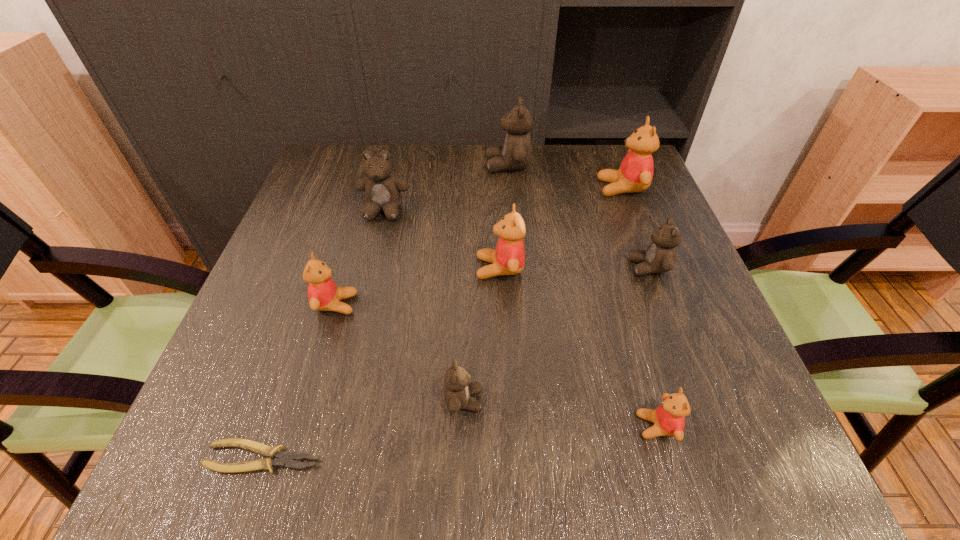
The width and height of the screenshot is (960, 540). In order to click on vacant space located on the front-facing side of the smallest red teddy bear in this screenshot , I will do `click(424, 426)`.

Find the location of a particular element. Image resolution: width=960 pixels, height=540 pixels. vacant area located 0.080m on the front-facing side of the smallest red teddy bear is located at coordinates (587, 426).

Where is `free space located 0.400m on the right of the pliers`? This screenshot has width=960, height=540. free space located 0.400m on the right of the pliers is located at coordinates (591, 457).

Locate an element on the screen. The width and height of the screenshot is (960, 540). teddy bear that is at the near edge is located at coordinates (669, 418).

Locate an element on the screen. The height and width of the screenshot is (540, 960). pliers that is at the near edge is located at coordinates (283, 459).

Locate an element on the screen. This screenshot has width=960, height=540. pliers that is at the left edge is located at coordinates (283, 459).

Identify the location of object present at the near left corner. (283, 459).

Identify the location of object at the far right corner. Image resolution: width=960 pixels, height=540 pixels. (635, 174).

Identify the location of object present at the near right corner. (669, 418).

You are a GUI agent. You are given a task and a screenshot of the screen. Output one action in this format:
    pyautogui.click(x=<x>, y=<y>)
    Task: Click on the blank space at the far edge of the desktop
    This screenshot has width=960, height=540.
    Given the screenshot: What is the action you would take?
    pyautogui.click(x=552, y=165)